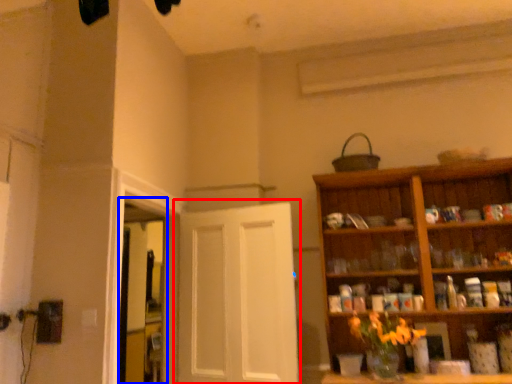
Question: Which object is further to the camera taking this photo, door (highlighted by a red box) or window (highlighted by a blue box)?

Choices:
 (A) door
 (B) window

Answer: (B)